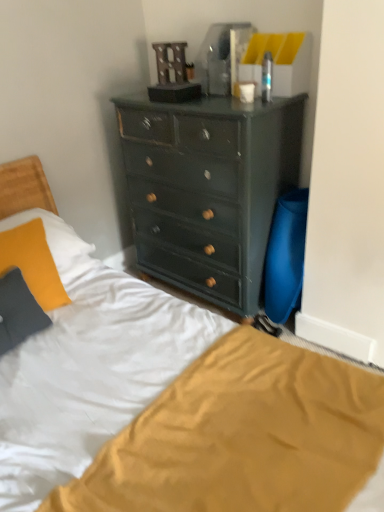
Where is `velvet yellow pillow at left`? The width and height of the screenshot is (384, 512). velvet yellow pillow at left is located at coordinates pos(33,263).

The width and height of the screenshot is (384, 512). Describe the element at coordinates (33, 263) in the screenshot. I see `velvet yellow pillow at left` at that location.

You are a GUI agent. You are given a task and a screenshot of the screen. Output one action in this format:
    pyautogui.click(x=<x>, y=<y>)
    Task: Click on the velvet yellow pillow at left
    
    Given the screenshot: What is the action you would take?
    pyautogui.click(x=33, y=263)